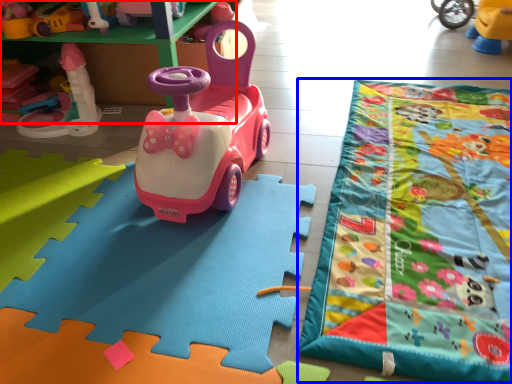
Question: Which point is further to the camera, toy (highlighted by a red box) or blanket (highlighted by a blue box)?

Choices:
 (A) toy
 (B) blanket

Answer: (A)